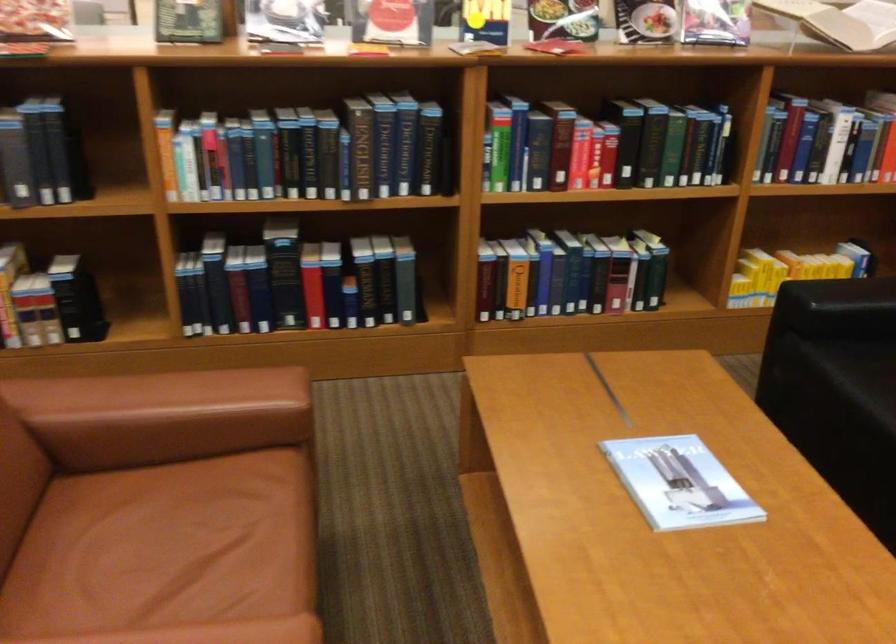
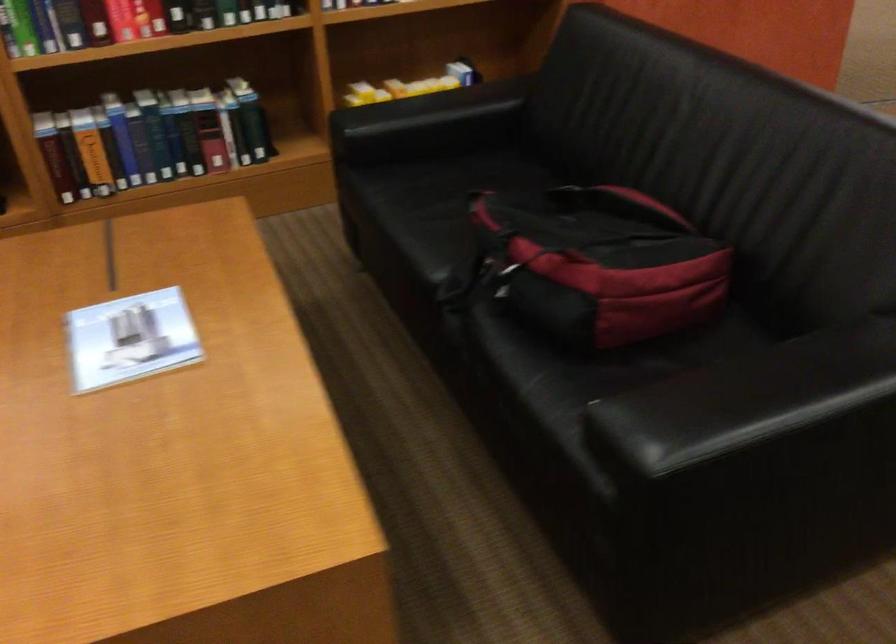
Find the pixel in the second image that matches (573,277) in the first image.

(151, 138)